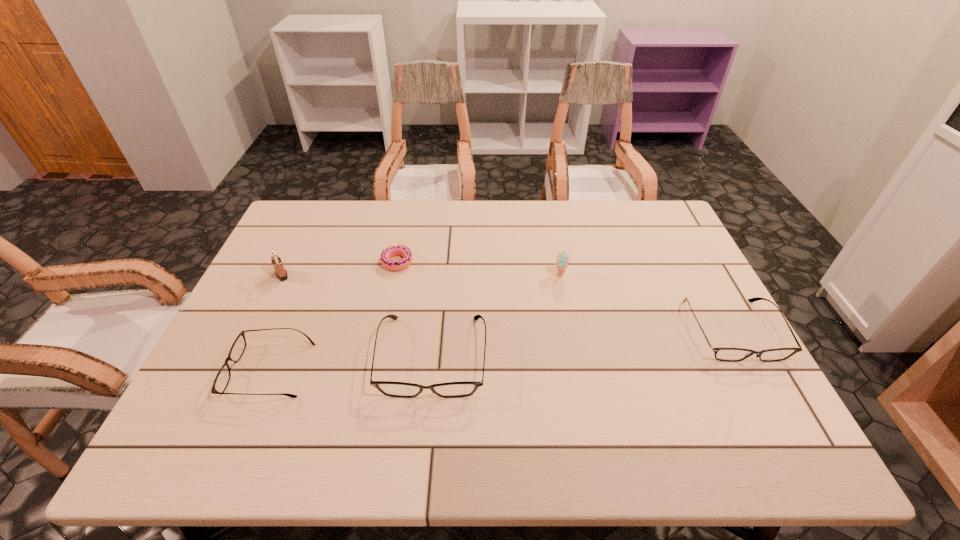
If equal spacing is desired by inserting an extra spectacles among them, please point out a free spot for this new spectacles. Please provide its 2D coordinates. Your answer should be formatted as a tuple, i.e. [(x, y)], where the tuple contains the x and y coordinates of a point satisfying the conditions above.

[(587, 342)]